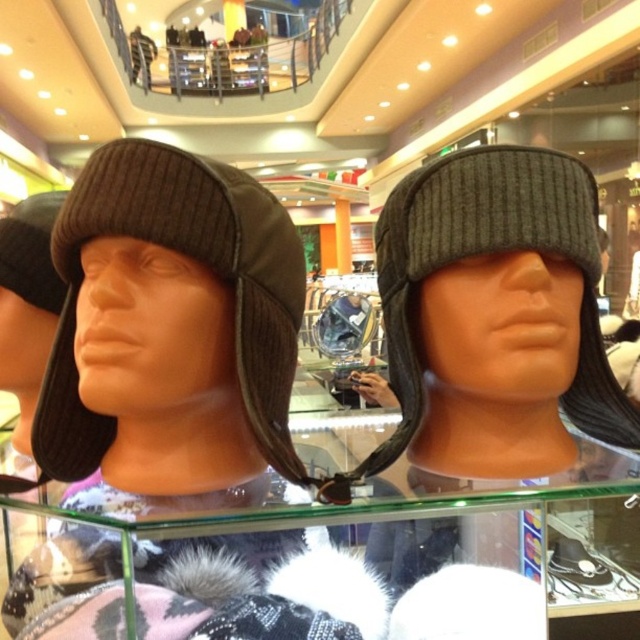
You are a store employee who needs to place a new hat that is 20 centimeters wide into the display case. Given the distance between the dark brown knit hat at left and the dark gray ribbed knit hat at center, can the new hat fit between them without overlapping?

The dark brown knit hat at left is 19.82 centimeters away from the dark gray ribbed knit hat at center. Since the new hat is 20 centimeters wide, it cannot fit between them as the space is slightly smaller than the hat.

You are a customer looking at the display case of winter hats. You want to know which hat is positioned to the left between the dark brown knit hat at left and the dark gray ribbed knit hat at center. Can you tell me which one is on the left?

The dark brown knit hat at left is positioned to the left of the dark gray ribbed knit hat at center, so the dark brown knit hat at left is the one on the left.

You are a photographer taking a picture of the display case with the mannequin heads wearing winter hats. You want to focus on the point at coordinates point (264, 289). What is the minimum distance you need to be from the display case to ensure the camera can focus on that point?

The point (264, 289) is 23.86 inches away from the camera, so you need to be at least 23.86 inches away from the display case to ensure the camera can focus on that point.